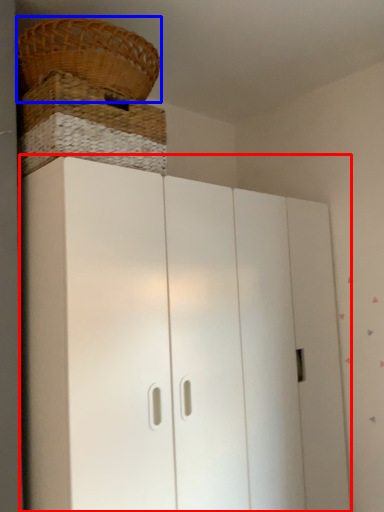
Question: Which of the following is the closest to the observer, cupboard (highlighted by a red box) or basket (highlighted by a blue box)?

Choices:
 (A) cupboard
 (B) basket

Answer: (A)